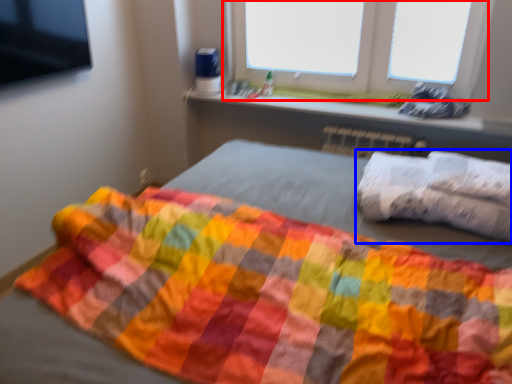
Question: Which object appears closest to the camera in this image, window (highlighted by a red box) or throw pillow (highlighted by a blue box)?

Choices:
 (A) window
 (B) throw pillow

Answer: (B)